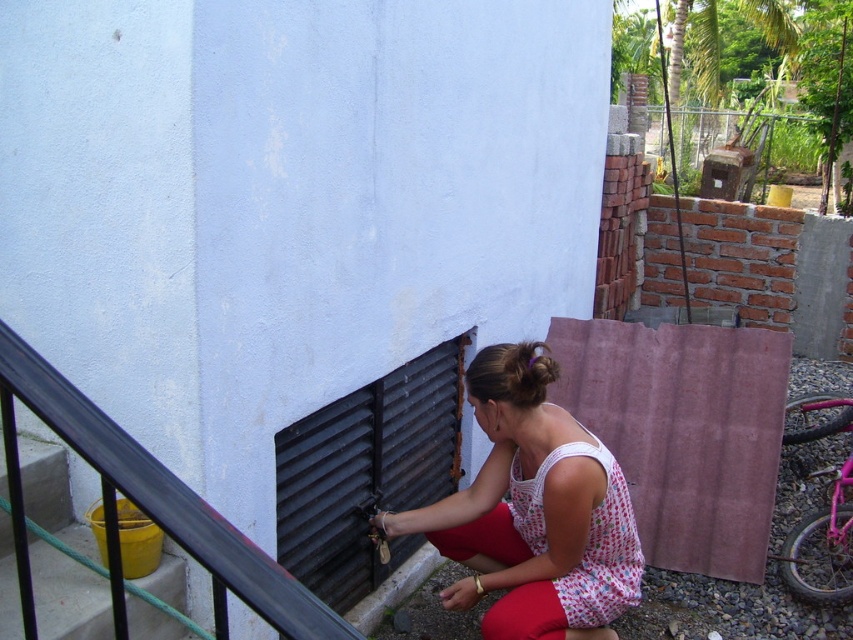
You are organizing a clothing display and have two dresses to place side by side. The white dotted dress at center and the white dotted fabric dress at lower center. Which dress should you place on the right side if you want the wider dress to be on the left?

The white dotted dress at center is wider than the white dotted fabric dress at lower center, so you should place the white dotted dress at center on the left and the white dotted fabric dress at lower center on the right.

You are standing at the point where the person is working on the wall. You need to move to the black metal rail located at point (148, 508). Which direction should you move to reach it?

The black metal rail at point (148, 508) is located at the lower left relative to your current position at the wall. Move towards the lower left direction to reach it.